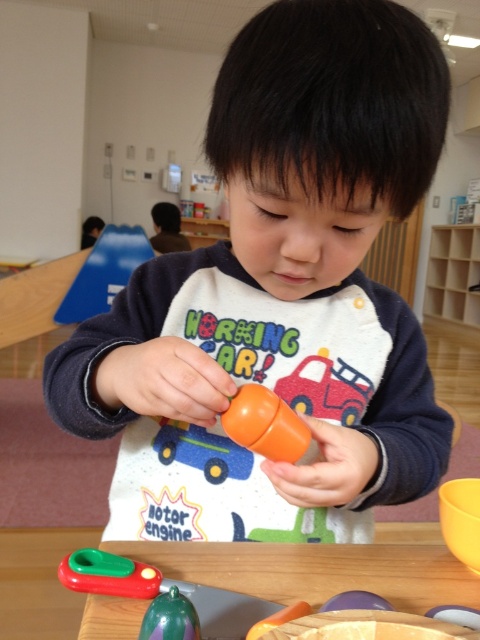
Which is below, orange matte cup at center or orange matte toy car at center?

orange matte toy car at center

Does orange matte cup at center have a greater width compared to orange matte toy car at center?

Incorrect, orange matte cup at center's width does not surpass orange matte toy car at center's.

Between point (252, 440) and point (217, 438), which one is positioned behind?

Positioned behind is point (217, 438).

Locate an element on the screen. The height and width of the screenshot is (640, 480). orange matte cup at center is located at coordinates (265, 424).

Does orange matte toy at center appear under orange matte cup at center?

Actually, orange matte toy at center is above orange matte cup at center.

From the picture: Between orange matte toy at center and orange matte cup at center, which one has more height?

orange matte toy at center is taller.

Identify the location of orange matte toy at center. (282, 291).

In the scene shown: Can you confirm if wooden table at center is wider than orange matte toy car at center?

Indeed, wooden table at center has a greater width compared to orange matte toy car at center.

Does point (137, 573) come closer to viewer compared to point (177, 452)?

Yes, it is.

The width and height of the screenshot is (480, 640). I want to click on wooden table at center, so click(x=368, y=627).